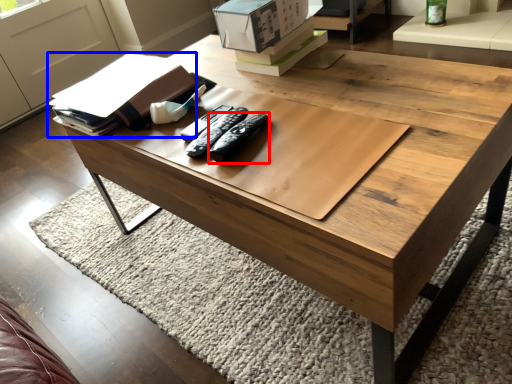
Question: Among these objects, which one is nearest to the camera, remote (highlighted by a red box) or book (highlighted by a blue box)?

Choices:
 (A) remote
 (B) book

Answer: (A)